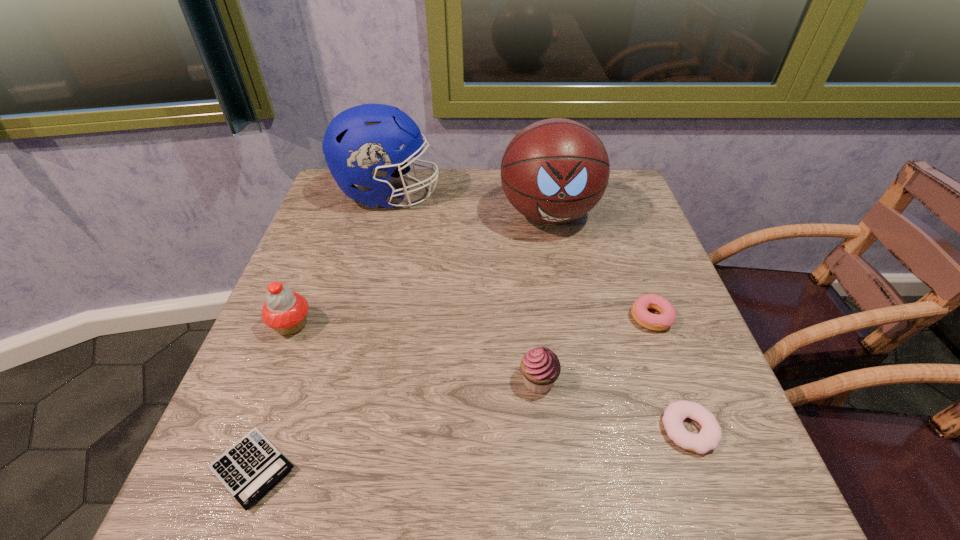
In order to click on calculator in this screenshot , I will do pos(252,466).

Identify the location of free space located 0.120m on the left of the basketball. The width and height of the screenshot is (960, 540). (452, 214).

Where is `free space located 0.270m on the front-facing side of the football helmet`? free space located 0.270m on the front-facing side of the football helmet is located at coordinates (540, 194).

The width and height of the screenshot is (960, 540). Find the location of `vacant space situated on the back of the farther cupcake`. vacant space situated on the back of the farther cupcake is located at coordinates (327, 235).

At what (x,y) coordinates should I click in order to perform the action: click on vacant position located on the left of the right cupcake. Please return your answer as a coordinate pair (x, y). This screenshot has height=540, width=960. Looking at the image, I should click on (462, 381).

I want to click on free space located on the front of the farther doughnut, so click(x=673, y=374).

The height and width of the screenshot is (540, 960). In order to click on vacant region located 0.190m on the back of the shorter doughnut in this screenshot , I will do `click(649, 319)`.

This screenshot has width=960, height=540. I want to click on free spot located on the right of the shortest object, so click(510, 468).

Image resolution: width=960 pixels, height=540 pixels. Find the location of `basketball that is at the far edge`. basketball that is at the far edge is located at coordinates (554, 171).

At what (x,y) coordinates should I click in order to perform the action: click on football helmet at the far edge. Please return your answer as a coordinate pair (x, y). Looking at the image, I should click on (361, 145).